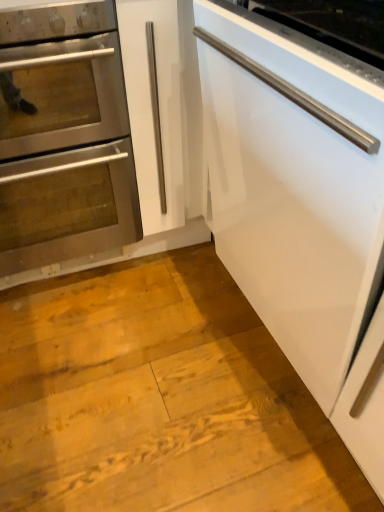
Question: Should I look upward or downward to see white glossy dishwasher at right?

Choices:
 (A) up
 (B) down

Answer: (A)

Question: Considering the relative sizes of white glossy dishwasher at right and stainless steel oven at left in the image provided, is white glossy dishwasher at right shorter than stainless steel oven at left?

Choices:
 (A) yes
 (B) no

Answer: (A)

Question: Is white glossy dishwasher at right outside of stainless steel oven at left?

Choices:
 (A) yes
 (B) no

Answer: (A)

Question: From the image's perspective, is white glossy dishwasher at right under stainless steel oven at left?

Choices:
 (A) yes
 (B) no

Answer: (A)

Question: Is white glossy dishwasher at right taller than stainless steel oven at left?

Choices:
 (A) yes
 (B) no

Answer: (B)

Question: Is white glossy dishwasher at right to the left of stainless steel oven at left from the viewer's perspective?

Choices:
 (A) no
 (B) yes

Answer: (A)

Question: From a real-world perspective, is white glossy dishwasher at right below stainless steel oven at left?

Choices:
 (A) yes
 (B) no

Answer: (B)

Question: Is white glossy dishwasher at right completely or partially inside stainless steel oven at left?

Choices:
 (A) yes
 (B) no

Answer: (B)

Question: Is stainless steel oven at left shorter than white glossy dishwasher at right?

Choices:
 (A) no
 (B) yes

Answer: (A)

Question: Does stainless steel oven at left appear on the right side of white glossy dishwasher at right?

Choices:
 (A) no
 (B) yes

Answer: (A)

Question: Is stainless steel oven at left turned away from white glossy dishwasher at right?

Choices:
 (A) yes
 (B) no

Answer: (B)

Question: From a real-world perspective, is stainless steel oven at left physically above white glossy dishwasher at right?

Choices:
 (A) no
 (B) yes

Answer: (A)

Question: From a real-world perspective, is stainless steel oven at left positioned under white glossy dishwasher at right based on gravity?

Choices:
 (A) no
 (B) yes

Answer: (B)

Question: From a real-world perspective, is stainless steel oven at left positioned above or below white glossy dishwasher at right?

Choices:
 (A) below
 (B) above

Answer: (A)